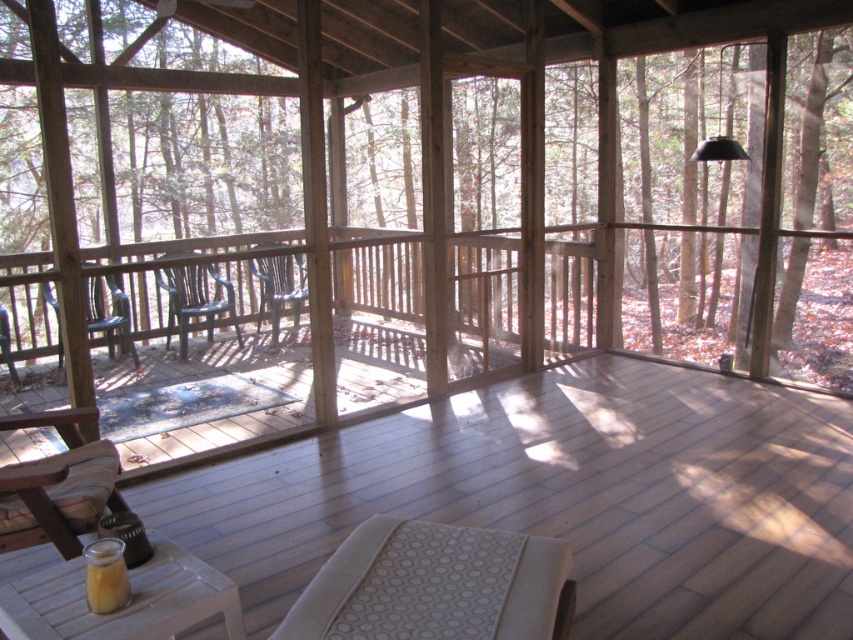
Question: Which object is closer to the camera taking this photo?

Choices:
 (A) translucent glass cup at lower left
 (B) metallic blue chair at center
 (C) wooden chair at center

Answer: (A)

Question: Which object is farther from the camera taking this photo?

Choices:
 (A) matte plastic chair at left
 (B) metallic blue chair at center

Answer: (B)

Question: Can you confirm if wooden deck at center is bigger than wooden chair at center?

Choices:
 (A) no
 (B) yes

Answer: (B)

Question: Can you confirm if wooden deck at center is smaller than matte plastic chair at left?

Choices:
 (A) no
 (B) yes

Answer: (A)

Question: Does translucent glass cup at lower left have a greater width compared to wooden chair at center?

Choices:
 (A) yes
 (B) no

Answer: (B)

Question: Estimate the real-world distances between objects in this image. Which object is closer to the matte plastic chair at center?

Choices:
 (A) matte plastic chair at left
 (B) wooden deck at center

Answer: (A)